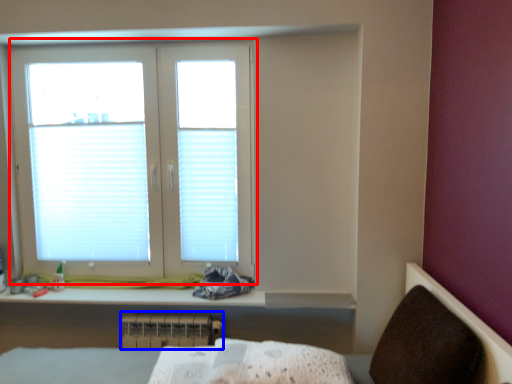
Question: Which point is further to the camera, window (highlighted by a red box) or radiator (highlighted by a blue box)?

Choices:
 (A) window
 (B) radiator

Answer: (B)